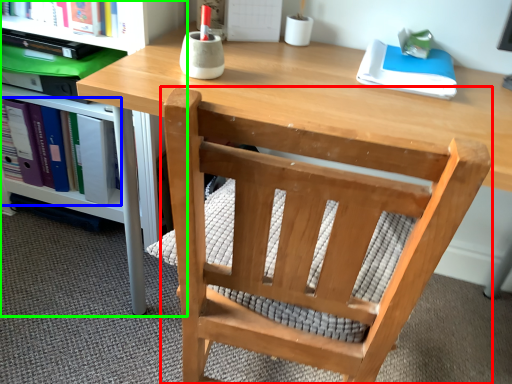
Question: Considering the real-world distances, which object is farthest from chair (highlighted by a red box)? book (highlighted by a blue box) or shelf (highlighted by a green box)?

Choices:
 (A) book
 (B) shelf

Answer: (A)